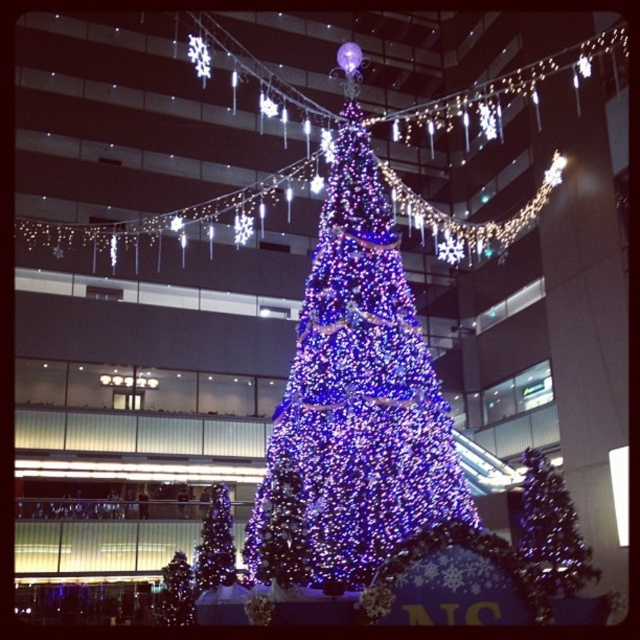
Question: Is iridescent blue lights at center to the left of iridescent glass christmas tree at center from the viewer's perspective?

Choices:
 (A) yes
 (B) no

Answer: (A)

Question: Does iridescent blue lights at center come behind iridescent glass christmas tree at lower left?

Choices:
 (A) no
 (B) yes

Answer: (A)

Question: Which object is farther from the camera taking this photo?

Choices:
 (A) blue glittering christmas tree at center
 (B) iridescent blue lights at center
 (C) iridescent glass christmas tree at center

Answer: (A)

Question: Which object appears closest to the camera in this image?

Choices:
 (A) iridescent glass christmas tree at lower left
 (B) iridescent glass christmas tree at center
 (C) blue glittering christmas tree at center
 (D) iridescent blue lights at center

Answer: (D)

Question: Which point is farther to the camera?

Choices:
 (A) iridescent glass christmas tree at lower left
 (B) blue glittering christmas tree at center
 (C) iridescent blue lights at center
 (D) iridescent glass christmas tree at center

Answer: (A)

Question: Is iridescent blue lights at center to the left of iridescent glass christmas tree at lower left from the viewer's perspective?

Choices:
 (A) yes
 (B) no

Answer: (B)